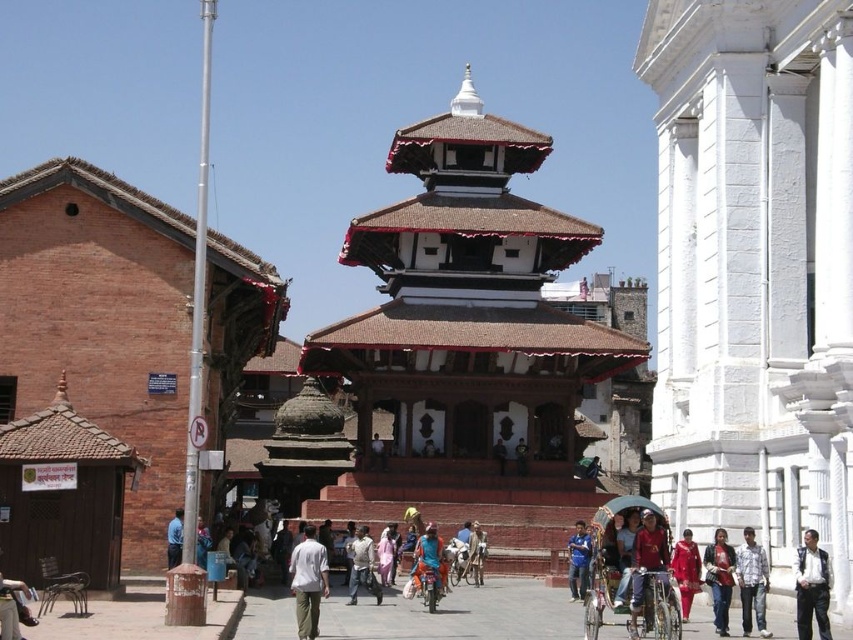
You are a photographer standing in front of the temple and see both the matte red shirt at center and the blue cotton shirt at center. Which shirt is closer to you?

The matte red shirt at center is closer to you because it is in front of the blue cotton shirt at center.

You are organizing a cultural event and need to display two shirts, the matte red shirt at center and the blue cotton shirt at center, in a showcase. Which shirt should you choose if you want to display the one that takes up more space?

The blue cotton shirt at center should be chosen because it occupies more space than the matte red shirt at center.

You are standing at the point indicated by the coordinates point [428,557] in the image. What object are you directly facing?

The point [428,557] indicates the blue fabric bicycle at center, so you are directly facing the blue fabric bicycle at center.